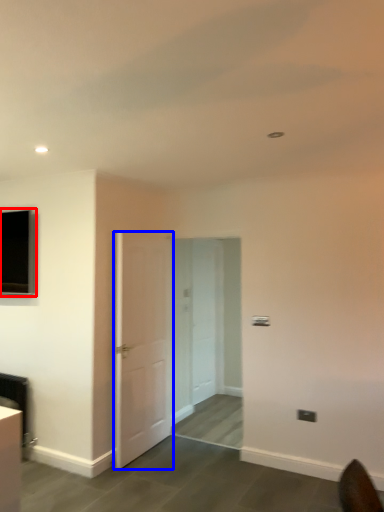
Question: Among these objects, which one is nearest to the camera, window (highlighted by a red box) or door (highlighted by a blue box)?

Choices:
 (A) window
 (B) door

Answer: (B)